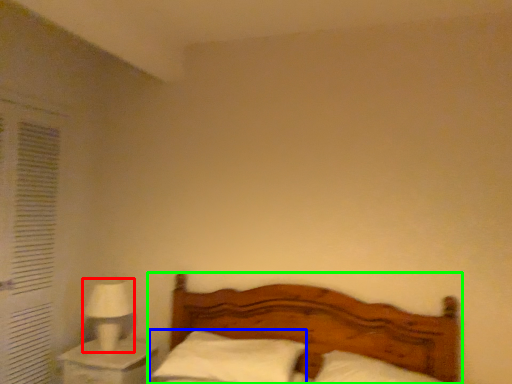
Question: Based on their relative distances, which object is nearer to table lamp (highlighted by a red box)? Choose from pillow (highlighted by a blue box) and bed (highlighted by a green box).

Choices:
 (A) pillow
 (B) bed

Answer: (A)